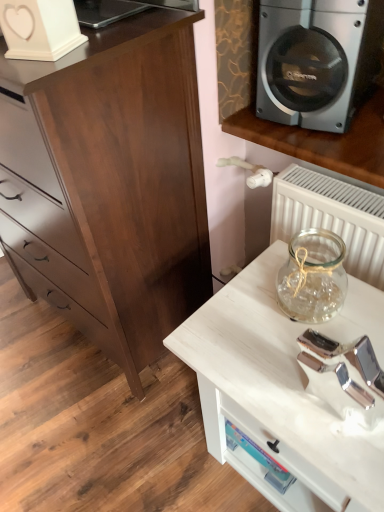
This screenshot has width=384, height=512. In order to click on vacant region above white wood table at lower right (from a real-world perspective) in this screenshot , I will do `click(302, 340)`.